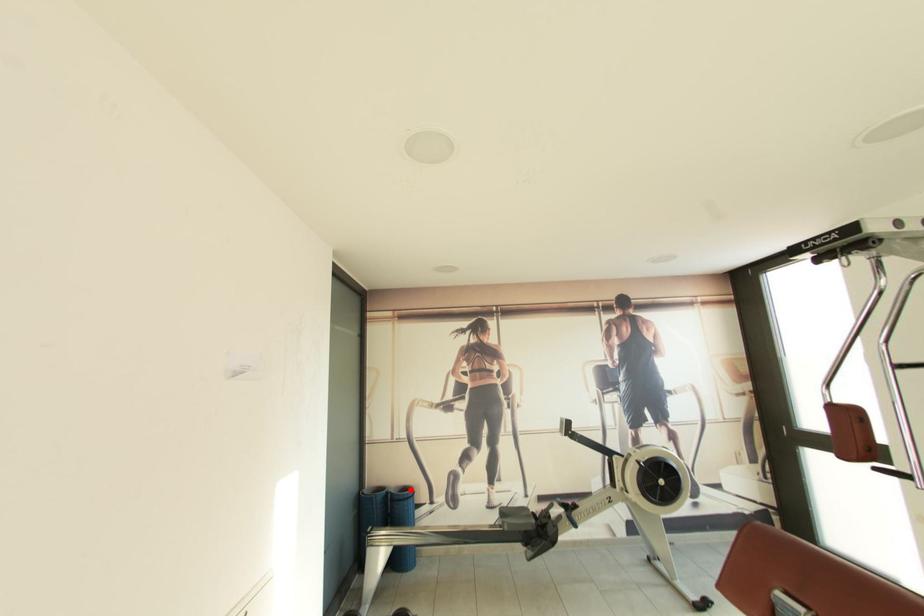
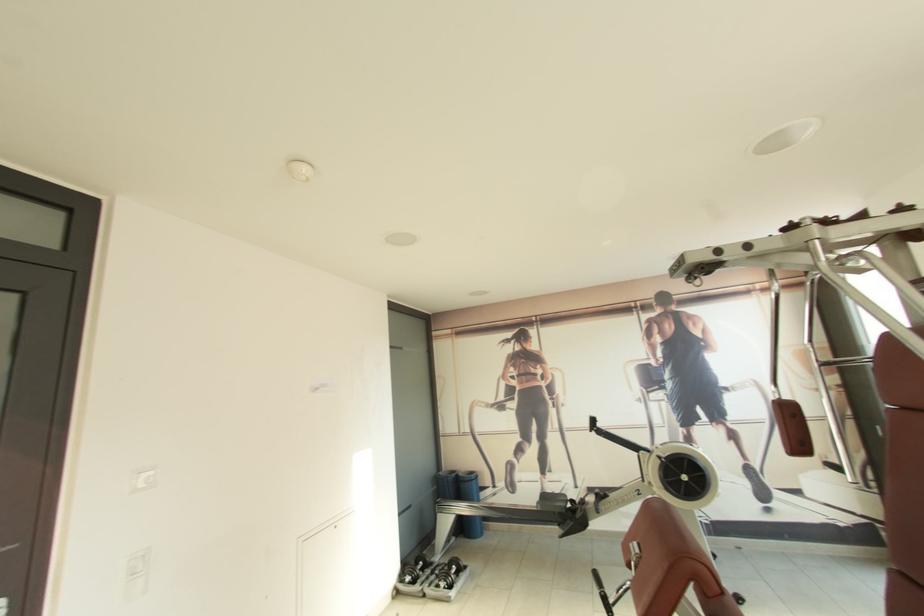
Locate, in the second image, the point that corresponds to the highlighted location in the first image.

(476, 475)